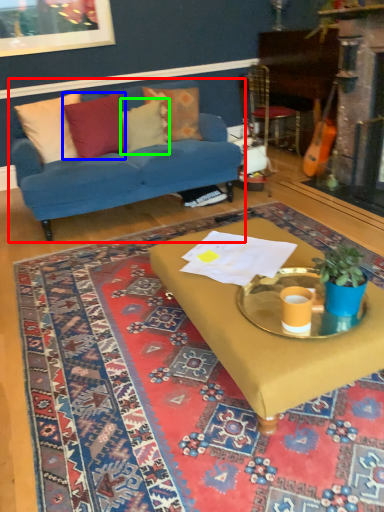
Question: Which object is positioned closest to studio couch (highlighted by a red box)? Select from pillow (highlighted by a blue box) and pillow (highlighted by a green box).

Choices:
 (A) pillow
 (B) pillow

Answer: (A)